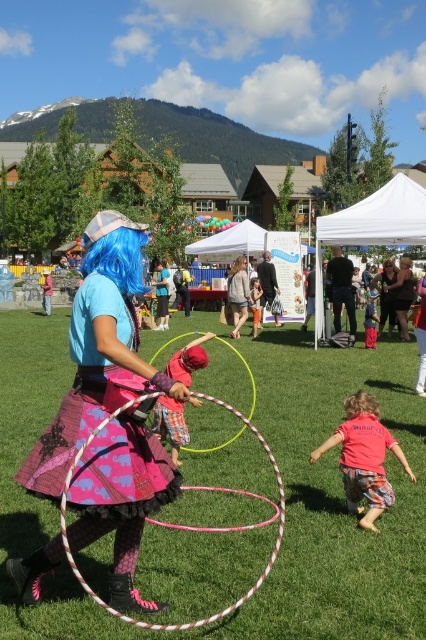
What is the 2D coordinate of the plaid fabric shirt at center?

The plaid fabric shirt at center is located at the 2D coordinate point of (170, 424).

You are a small dog trying to run through the area where the green grass at center and the matte pink skirt at center are located. Which one will you encounter first?

The green grass at center has a lesser height compared to matte pink skirt at center, so the small dog will encounter the green grass at center first since it is lower and closer to the ground.

You are a photographer at the event and want to take a photo of the matte pink skirt at center and the matte black dress at center. Which one should you focus on first if you want to capture the taller object in your shot?

The matte pink skirt at center is taller than the matte black dress at center, so you should focus on the matte pink skirt at center first to capture the taller object.